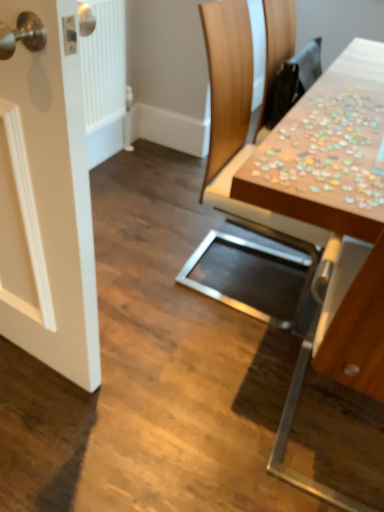
Locate an element on the screen. This screenshot has width=384, height=512. free location to the left of wooden chair at upper right is located at coordinates click(147, 264).